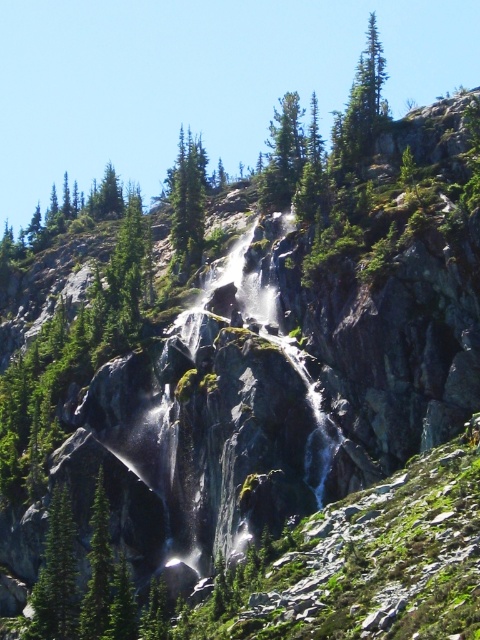
Who is more forward, (34, 602) or (101, 596)?

Point (101, 596)

Which of these two, green matte tree at center-left or green matte tree at lower left, stands shorter?

With less height is green matte tree at lower left.

Who is more forward, (55, 634) or (82, 634)?

Point (82, 634) is in front.

This screenshot has width=480, height=640. I want to click on green matte tree at center-left, so click(x=57, y=577).